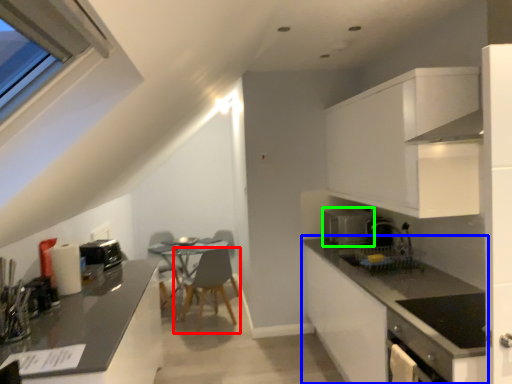
Question: Which object is the farthest from chair (highlighted by a red box)? Choose among these: countertop (highlighted by a blue box) or kitchen appliance (highlighted by a green box).

Choices:
 (A) countertop
 (B) kitchen appliance

Answer: (A)